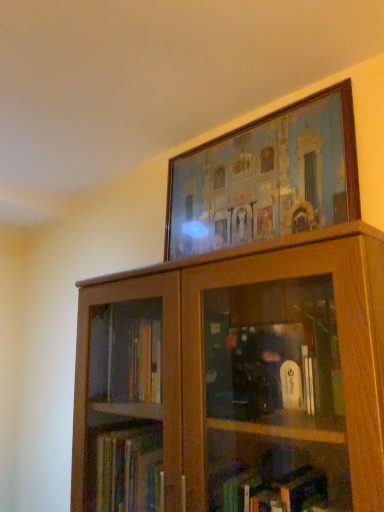
Question: Is wooden cabinet at upper center shorter than wooden picture frame at upper center?

Choices:
 (A) yes
 (B) no

Answer: (B)

Question: Is wooden cabinet at upper center positioned before wooden picture frame at upper center?

Choices:
 (A) yes
 (B) no

Answer: (A)

Question: Does wooden cabinet at upper center have a greater width compared to wooden picture frame at upper center?

Choices:
 (A) no
 (B) yes

Answer: (B)

Question: Considering the relative positions of wooden cabinet at upper center and wooden picture frame at upper center in the image provided, is wooden cabinet at upper center to the left of wooden picture frame at upper center from the viewer's perspective?

Choices:
 (A) yes
 (B) no

Answer: (A)

Question: Can you see wooden cabinet at upper center touching wooden picture frame at upper center?

Choices:
 (A) yes
 (B) no

Answer: (B)

Question: Would you consider wooden cabinet at upper center to be distant from wooden picture frame at upper center?

Choices:
 (A) yes
 (B) no

Answer: (B)

Question: Is wooden picture frame at upper center not near wooden cabinet at upper center?

Choices:
 (A) no
 (B) yes

Answer: (A)

Question: Is wooden picture frame at upper center taller than wooden cabinet at upper center?

Choices:
 (A) no
 (B) yes

Answer: (A)

Question: From the image's perspective, is wooden picture frame at upper center on top of wooden cabinet at upper center?

Choices:
 (A) no
 (B) yes

Answer: (B)

Question: Is wooden picture frame at upper center thinner than wooden cabinet at upper center?

Choices:
 (A) yes
 (B) no

Answer: (A)

Question: Is wooden picture frame at upper center facing towards wooden cabinet at upper center?

Choices:
 (A) yes
 (B) no

Answer: (B)

Question: Considering the relative positions of wooden picture frame at upper center and wooden cabinet at upper center in the image provided, is wooden picture frame at upper center behind wooden cabinet at upper center?

Choices:
 (A) yes
 (B) no

Answer: (A)

Question: Is wooden picture frame at upper center to the left or to the right of wooden cabinet at upper center in the image?

Choices:
 (A) left
 (B) right

Answer: (B)